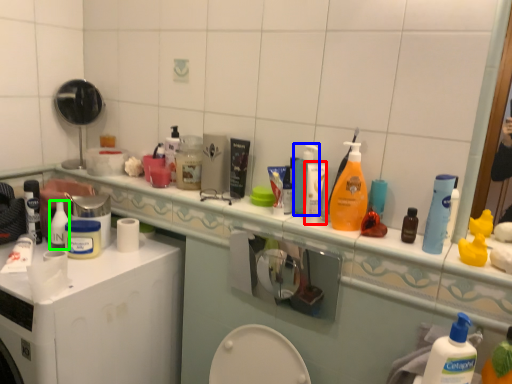
Question: Based on their relative distances, which object is nearer to toiletry (highlighted by a red box)? Choose from cleaning product (highlighted by a blue box) and toiletry (highlighted by a green box).

Choices:
 (A) cleaning product
 (B) toiletry

Answer: (A)